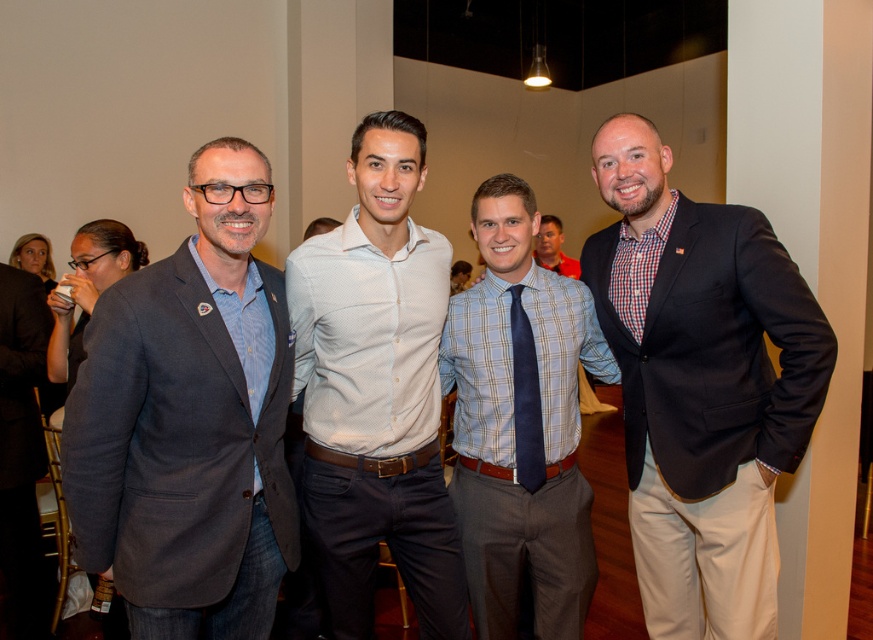
The image size is (873, 640). What do you see at coordinates (376, 394) in the screenshot?
I see `white textured shirt at center` at bounding box center [376, 394].

This screenshot has height=640, width=873. Identify the location of white textured shirt at center. (376, 394).

Does dark blue suit at right have a greater width compared to white textured shirt at center?

Yes, dark blue suit at right is wider than white textured shirt at center.

Can you confirm if dark blue suit at right is positioned to the right of white textured shirt at center?

Indeed, dark blue suit at right is positioned on the right side of white textured shirt at center.

Between point (686, 401) and point (370, 508), which one is positioned behind?

The point (686, 401) is more distant.

Identify the location of dark blue suit at right. (700, 385).

Who is higher up, blue plaid shirt at center or navy satin tie at center?

navy satin tie at center

Which is more to the left, blue plaid shirt at center or navy satin tie at center?

Positioned to the left is navy satin tie at center.

Between point (512, 497) and point (530, 429), which one is positioned in front?

Point (530, 429)

The width and height of the screenshot is (873, 640). In order to click on blue plaid shirt at center in this screenshot , I will do `click(520, 426)`.